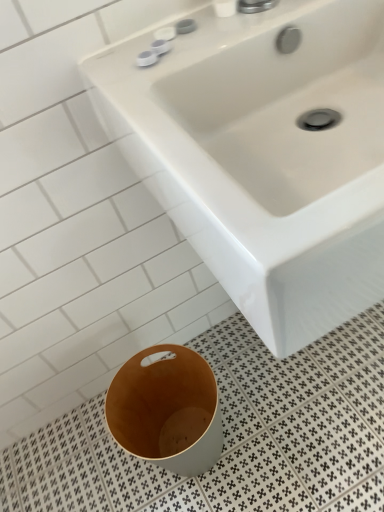
Describe the element at coordinates (265, 155) in the screenshot. I see `white glossy sink at upper center` at that location.

What is the approximate height of white glossy sink at upper center?

It is 16.56 inches.

The width and height of the screenshot is (384, 512). Identify the location of white glossy sink at upper center. (265, 155).

This screenshot has width=384, height=512. I want to click on white glossy sink at upper center, so click(x=265, y=155).